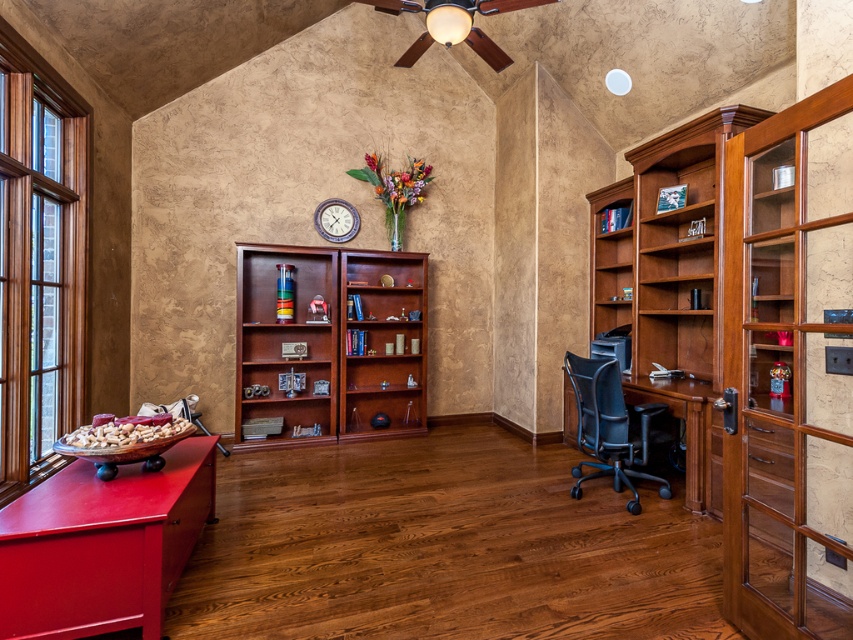
Question: Which object is closer to the camera taking this photo?

Choices:
 (A) wooden frame at left
 (B) cherry wood bookcase at center
 (C) black mesh swivel chair at lower right
 (D) matte red cabinet at lower left

Answer: (D)

Question: Considering the relative positions of matte red cabinet at lower left and black mesh swivel chair at lower right in the image provided, where is matte red cabinet at lower left located with respect to black mesh swivel chair at lower right?

Choices:
 (A) left
 (B) right

Answer: (A)

Question: Which object appears farthest from the camera in this image?

Choices:
 (A) cherry wood bookcase at center
 (B) black mesh swivel chair at lower right

Answer: (A)

Question: Is matte red cabinet at lower left smaller than cherry wood bookcase at center?

Choices:
 (A) yes
 (B) no

Answer: (A)

Question: Can you confirm if matte red cabinet at lower left is positioned to the left of black mesh swivel chair at lower right?

Choices:
 (A) no
 (B) yes

Answer: (B)

Question: Which object appears closest to the camera in this image?

Choices:
 (A) black mesh swivel chair at lower right
 (B) wooden frame at left
 (C) mahogany wood bookcase at right

Answer: (B)